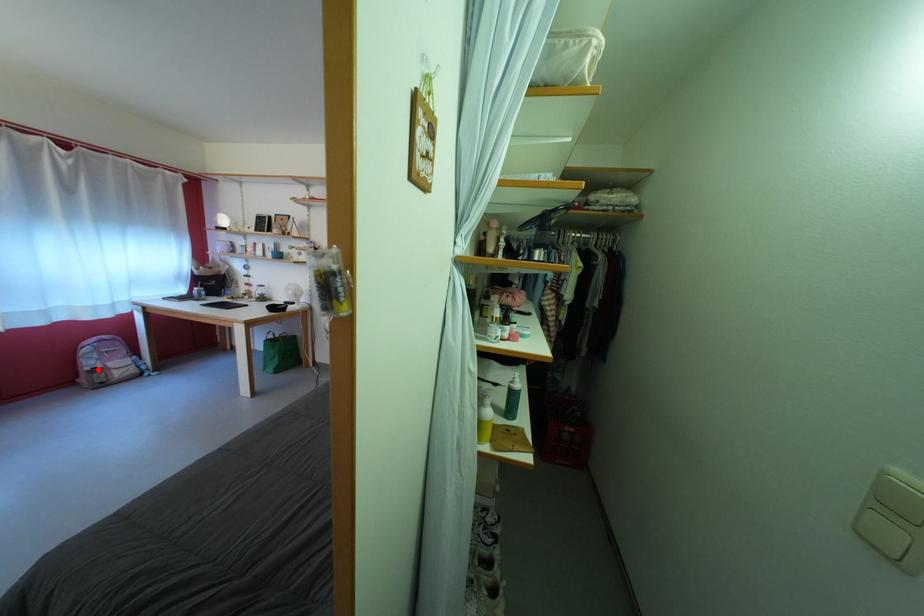
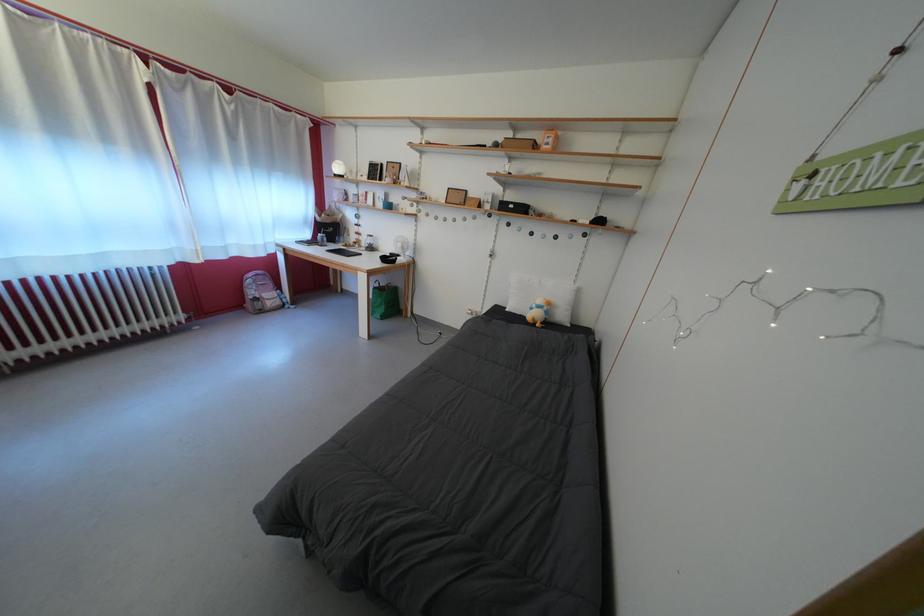
Where in the second image is the point corresponding to the highlighted location from the first image?

(261, 299)